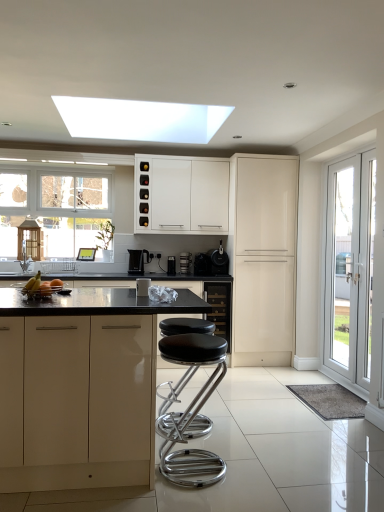
Question: Which direction should I rotate to face black plastic coffee maker at center, marked as the fourth appliance in a front-to-back arrangement, — up or down?

Choices:
 (A) down
 (B) up

Answer: (A)

Question: Can you confirm if satin black toaster at center, which is the 5th appliance in front-to-back order, is bigger than black matte coffee maker at center, which is counted as the 2th appliance, starting from the front?

Choices:
 (A) no
 (B) yes

Answer: (A)

Question: Is satin black toaster at center, which is counted as the 3th appliance, starting from the left, smaller than black matte coffee maker at center, the first appliance from the right?

Choices:
 (A) yes
 (B) no

Answer: (A)

Question: Is satin black toaster at center, the 1th appliance from the back, turned away from black matte coffee maker at center, which is counted as the 2th appliance, starting from the front?

Choices:
 (A) yes
 (B) no

Answer: (B)

Question: Is satin black toaster at center, the third appliance viewed from the right, surrounding black matte coffee maker at center, which ranks as the fourth appliance in back-to-front order?

Choices:
 (A) yes
 (B) no

Answer: (B)

Question: Would you consider satin black toaster at center, the third appliance viewed from the right, to be distant from black matte coffee maker at center, the first appliance from the right?

Choices:
 (A) yes
 (B) no

Answer: (B)

Question: Considering the relative sizes of satin black toaster at center, which is counted as the 3th appliance, starting from the left, and black matte coffee maker at center, marked as the 5th appliance in a left-to-right arrangement, in the image provided, is satin black toaster at center, which is counted as the 3th appliance, starting from the left, thinner than black matte coffee maker at center, marked as the 5th appliance in a left-to-right arrangement,?

Choices:
 (A) yes
 (B) no

Answer: (A)

Question: Considering the relative sizes of yellow matte bananas at center and black matte coffee maker at center, marked as the 5th appliance in a left-to-right arrangement, in the image provided, is yellow matte bananas at center thinner than black matte coffee maker at center, marked as the 5th appliance in a left-to-right arrangement,?

Choices:
 (A) no
 (B) yes

Answer: (B)

Question: Is black matte coffee maker at center, the first appliance from the right, a part of yellow matte bananas at center?

Choices:
 (A) yes
 (B) no

Answer: (B)

Question: Does yellow matte bananas at center have a smaller size compared to black matte coffee maker at center, which ranks as the fourth appliance in back-to-front order?

Choices:
 (A) yes
 (B) no

Answer: (A)

Question: Does yellow matte bananas at center come behind black matte coffee maker at center, marked as the 5th appliance in a left-to-right arrangement?

Choices:
 (A) no
 (B) yes

Answer: (A)

Question: Can you confirm if yellow matte bananas at center is positioned to the left of black matte coffee maker at center, marked as the 5th appliance in a left-to-right arrangement?

Choices:
 (A) no
 (B) yes

Answer: (B)

Question: From a real-world perspective, does yellow matte bananas at center stand above black matte coffee maker at center, marked as the 5th appliance in a left-to-right arrangement?

Choices:
 (A) yes
 (B) no

Answer: (B)

Question: Could you tell me if satin black toaster at center, the 1th appliance from the back, is facing polished chrome stool at center?

Choices:
 (A) no
 (B) yes

Answer: (B)